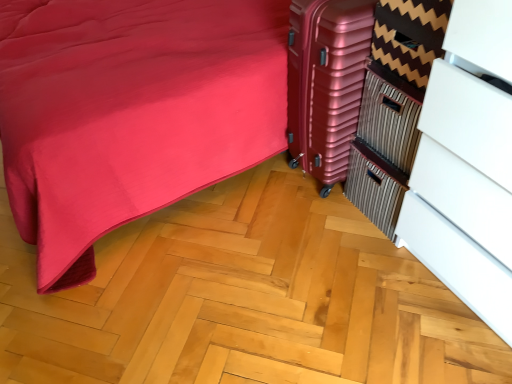
Question: Considering the relative sizes of white glossy dresser at right and metallic pink suitcase at center-right in the image provided, is white glossy dresser at right wider than metallic pink suitcase at center-right?

Choices:
 (A) no
 (B) yes

Answer: (A)

Question: Does white glossy dresser at right have a lesser width compared to metallic pink suitcase at center-right?

Choices:
 (A) no
 (B) yes

Answer: (B)

Question: From a real-world perspective, is white glossy dresser at right over metallic pink suitcase at center-right?

Choices:
 (A) yes
 (B) no

Answer: (A)

Question: Could you tell me if white glossy dresser at right is facing metallic pink suitcase at center-right?

Choices:
 (A) no
 (B) yes

Answer: (A)

Question: Can you confirm if white glossy dresser at right is bigger than metallic pink suitcase at center-right?

Choices:
 (A) yes
 (B) no

Answer: (A)

Question: Considering the relative positions of white glossy dresser at right and metallic pink suitcase at center-right in the image provided, is white glossy dresser at right to the left of metallic pink suitcase at center-right from the viewer's perspective?

Choices:
 (A) no
 (B) yes

Answer: (A)

Question: Can we say metallic pink suitcase at center-right lies outside white glossy dresser at right?

Choices:
 (A) no
 (B) yes

Answer: (B)

Question: Would you say metallic pink suitcase at center-right is a long distance from white glossy dresser at right?

Choices:
 (A) no
 (B) yes

Answer: (A)

Question: Would you say metallic pink suitcase at center-right contains white glossy dresser at right?

Choices:
 (A) yes
 (B) no

Answer: (B)

Question: Considering the relative sizes of metallic pink suitcase at center-right and white glossy dresser at right in the image provided, is metallic pink suitcase at center-right taller than white glossy dresser at right?

Choices:
 (A) no
 (B) yes

Answer: (A)

Question: Can you confirm if metallic pink suitcase at center-right is bigger than white glossy dresser at right?

Choices:
 (A) yes
 (B) no

Answer: (B)

Question: Is metallic pink suitcase at center-right at the left side of white glossy dresser at right?

Choices:
 (A) no
 (B) yes

Answer: (B)

Question: From the image's perspective, is metallic pink suitcase at center-right located above or below white glossy dresser at right?

Choices:
 (A) above
 (B) below

Answer: (A)